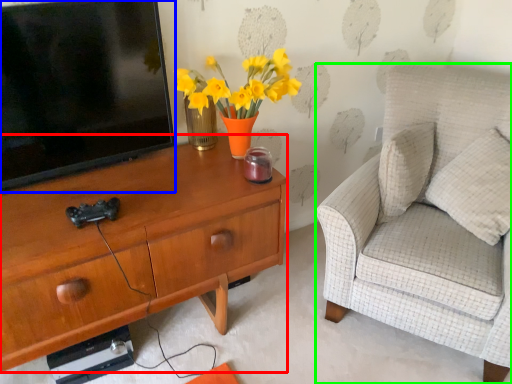
Question: Which is farther away from desk (highlighted by a red box)? television (highlighted by a blue box) or chair (highlighted by a green box)?

Choices:
 (A) television
 (B) chair

Answer: (B)